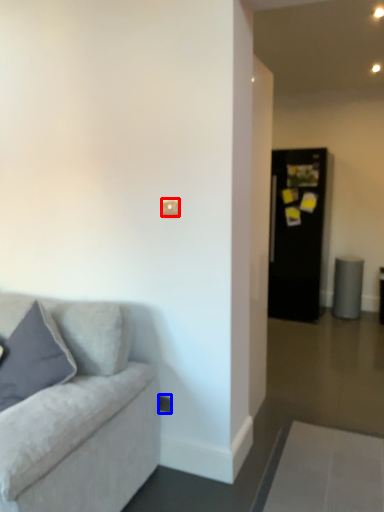
Question: Which object appears closest to the camera in this image, light switch (highlighted by a red box) or electric outlet (highlighted by a blue box)?

Choices:
 (A) light switch
 (B) electric outlet

Answer: (A)